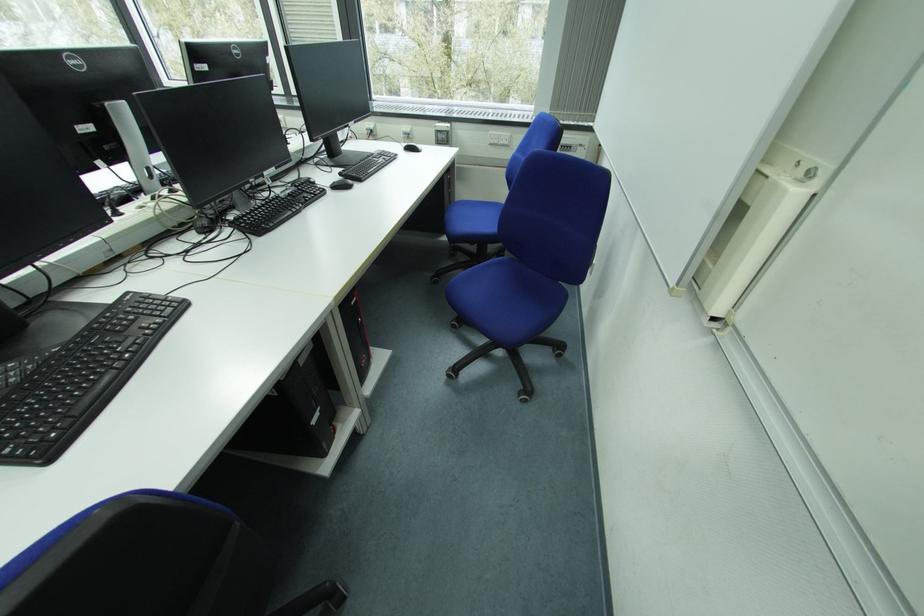
The width and height of the screenshot is (924, 616). What do you see at coordinates (809, 175) in the screenshot?
I see `a whiteboard sliding handle` at bounding box center [809, 175].